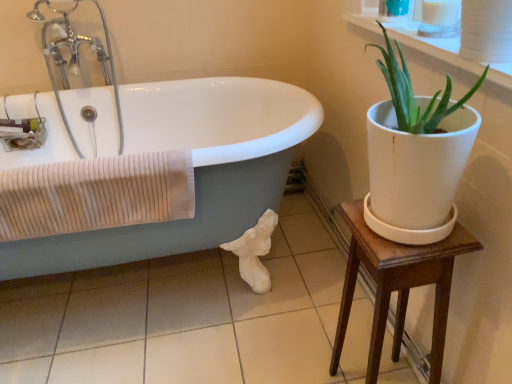
Locate an element on the screen. free space above beige ribbed towel at left (from a real-world perspective) is located at coordinates (74, 165).